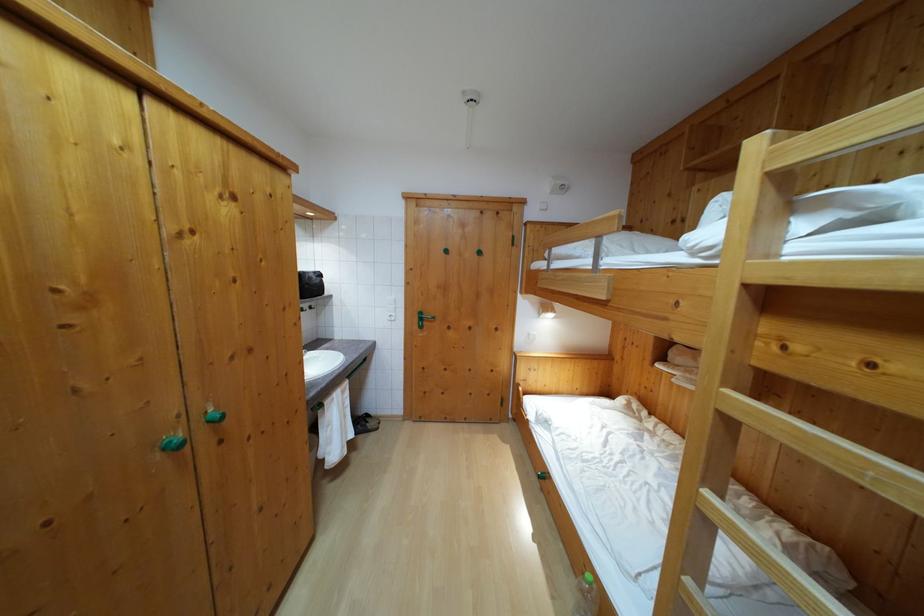
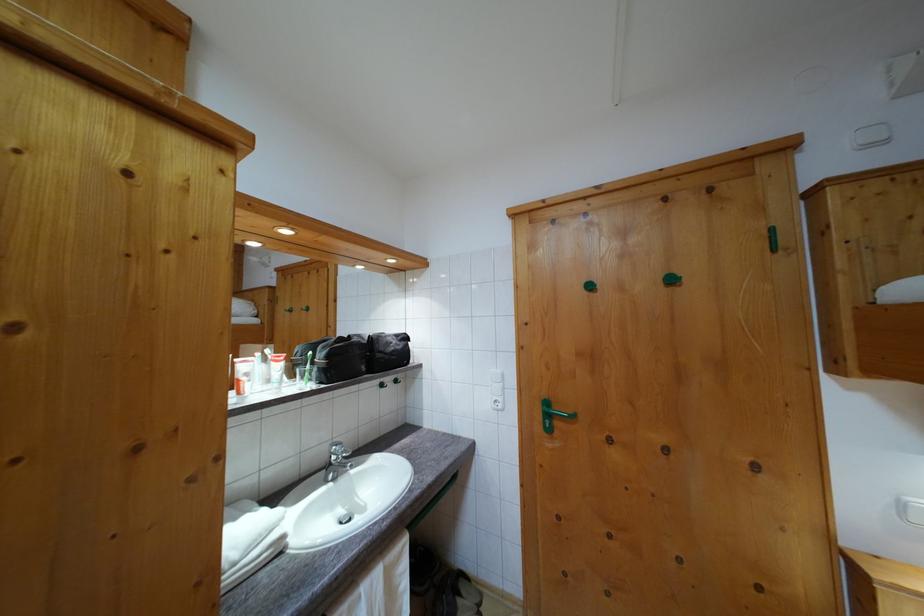
Question: The camera is either moving clockwise (left) or counter-clockwise (right) around the object. The first image is from the beginning of the video and the second image is from the end. Is the camera moving left or right when shooting the video?

Choices:
 (A) Left
 (B) Right

Answer: (B)